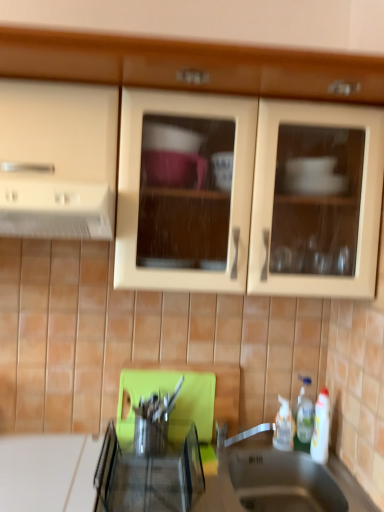
The image size is (384, 512). What are the coordinates of `free point below white matte exhaust hood at left (from a real-world perspective)` in the screenshot? It's located at (48, 466).